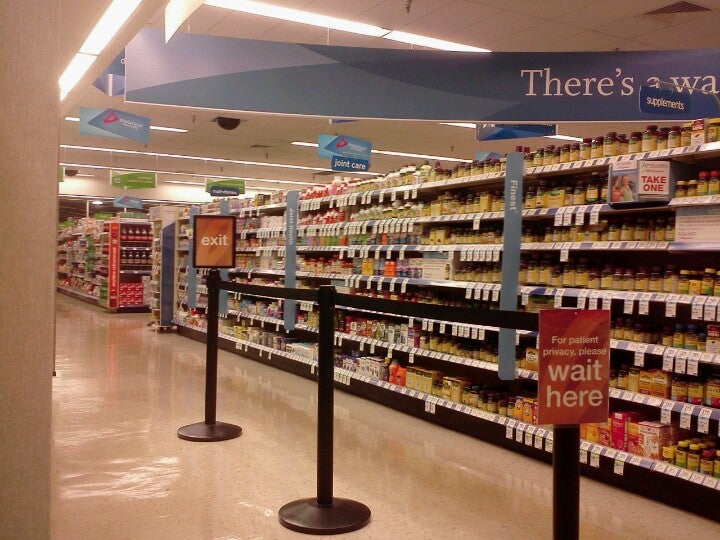
Locate an element on the screen. floor is located at coordinates (120, 430).